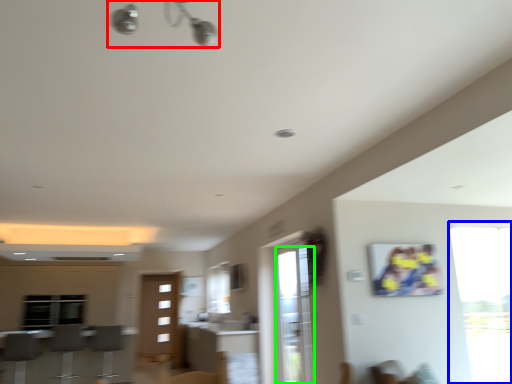
Question: Which object is the farthest from light fixture (highlighted by a red box)? Choose among these: window (highlighted by a blue box) or screen door (highlighted by a green box).

Choices:
 (A) window
 (B) screen door

Answer: (A)